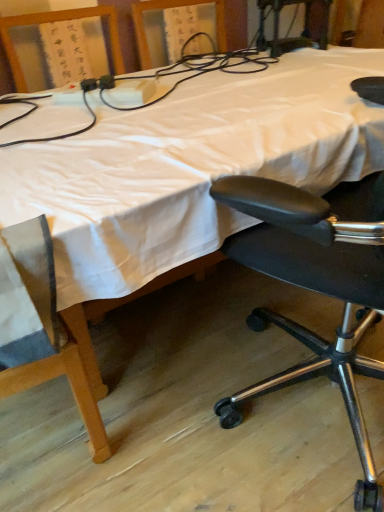
Question: Is white fabric bed at center inside the boundaries of white plastic power strip at upper left, or outside?

Choices:
 (A) outside
 (B) inside

Answer: (A)

Question: Is point (213, 139) positioned closer to the camera than point (253, 71)?

Choices:
 (A) closer
 (B) farther

Answer: (A)

Question: Which of these objects is positioned farthest from the white plastic power strip at upper left?

Choices:
 (A) black leather office chair at right
 (B) white fabric bed at center

Answer: (A)

Question: Estimate the real-world distances between objects in this image. Which object is farther from the white plastic power strip at upper left?

Choices:
 (A) black leather office chair at right
 (B) white fabric bed at center

Answer: (A)